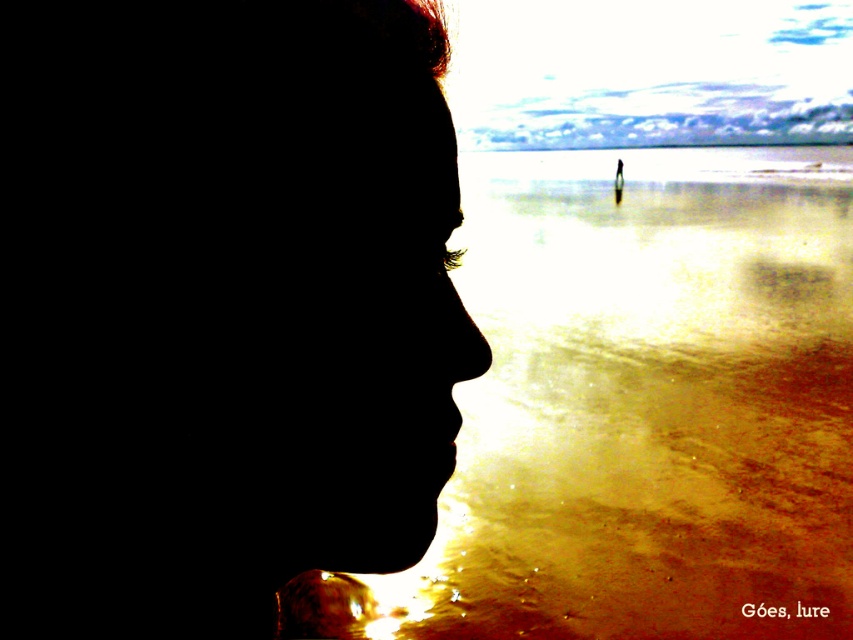
Question: Which point is farther to the camera?

Choices:
 (A) translucent golden water at center
 (B) black matte face at left

Answer: (A)

Question: Can you confirm if black matte face at left is positioned above translucent golden water at center?

Choices:
 (A) yes
 (B) no

Answer: (B)

Question: Which object is farther from the camera taking this photo?

Choices:
 (A) translucent golden water at center
 (B) black matte face at left

Answer: (A)

Question: Is black matte face at left positioned in front of translucent golden water at center?

Choices:
 (A) no
 (B) yes

Answer: (B)

Question: Does black matte face at left appear on the right side of translucent golden water at center?

Choices:
 (A) no
 (B) yes

Answer: (A)